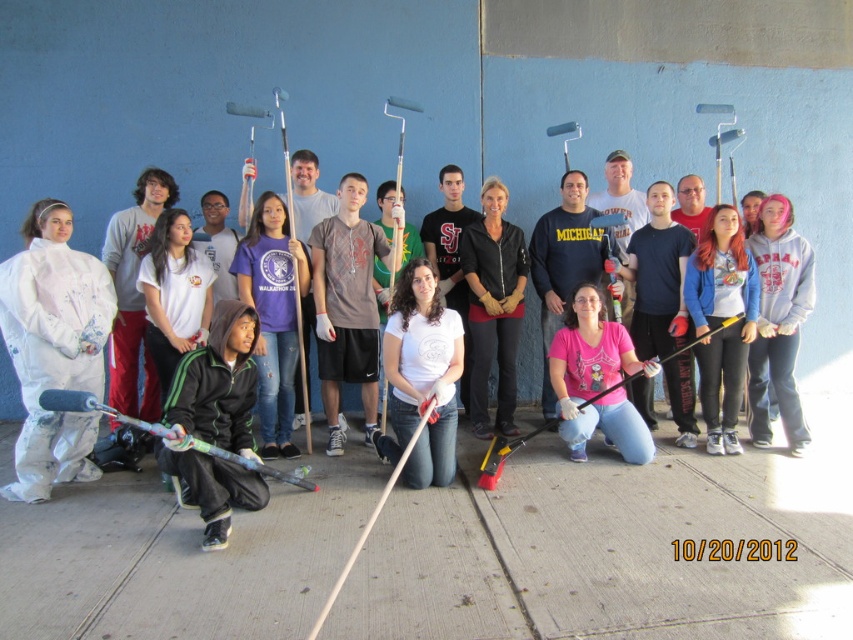
Which of these two, gray fleece sweatshirt at center or black leather jacket at center, stands taller?

Standing taller between the two is black leather jacket at center.

Is gray fleece sweatshirt at center taller than black leather jacket at center?

In fact, gray fleece sweatshirt at center may be shorter than black leather jacket at center.

Identify the location of gray fleece sweatshirt at center. (778, 321).

Does green hoodie at center come behind black leather jacket at center?

No, green hoodie at center is in front of black leather jacket at center.

Is green hoodie at center closer to camera compared to black leather jacket at center?

Yes, green hoodie at center is in front of black leather jacket at center.

Does point (167, 416) come closer to viewer compared to point (503, 288)?

Yes, point (167, 416) is in front of point (503, 288).

This screenshot has height=640, width=853. What are the coordinates of `green hoodie at center` in the screenshot? It's located at (218, 381).

Is white matte coveralls at left above gray fleece sweatshirt at center?

No.

Is white matte coveralls at left wider than gray fleece sweatshirt at center?

Indeed, white matte coveralls at left has a greater width compared to gray fleece sweatshirt at center.

Image resolution: width=853 pixels, height=640 pixels. I want to click on white matte coveralls at left, so click(53, 348).

Image resolution: width=853 pixels, height=640 pixels. Find the location of `white matte coveralls at left`. white matte coveralls at left is located at coordinates (53, 348).